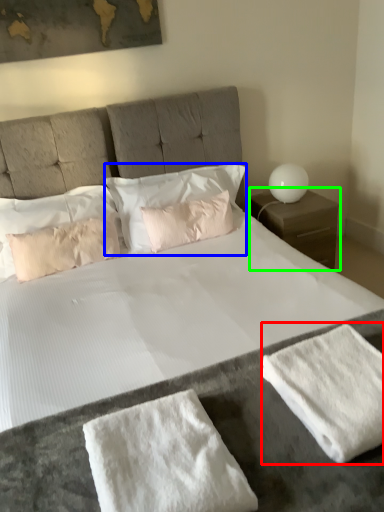
Question: Estimate the real-world distances between objects in this image. Which object is closer to bath towel (highlighted by a red box), pillow (highlighted by a blue box) or nightstand (highlighted by a green box)?

Choices:
 (A) pillow
 (B) nightstand

Answer: (A)